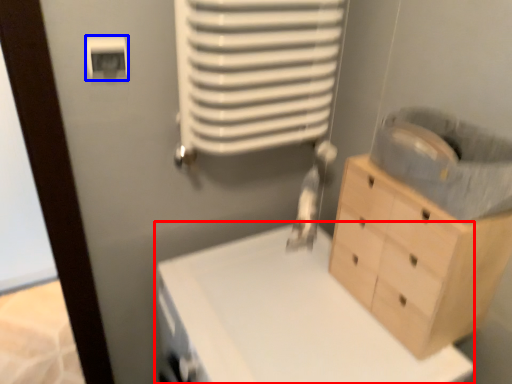
Question: Which point is further to the camera, changing table (highlighted by a red box) or light switch (highlighted by a blue box)?

Choices:
 (A) changing table
 (B) light switch

Answer: (B)